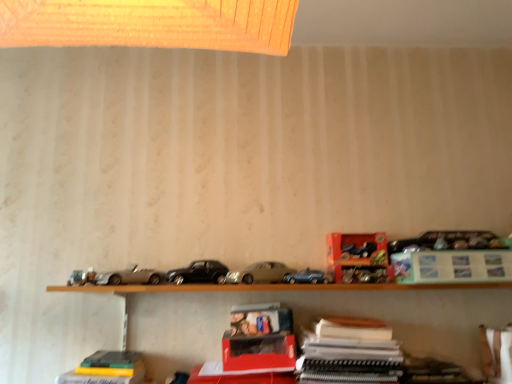
Question: Considering the relative sizes of metallic blue car at upper right, which is counted as the 1th toy, starting from the top, and matte silver car at center, acting as the first car starting from the right, in the image provided, is metallic blue car at upper right, which is counted as the 1th toy, starting from the top, wider than matte silver car at center, acting as the first car starting from the right,?

Choices:
 (A) yes
 (B) no

Answer: (B)

Question: Is metallic blue car at upper right, which is counted as the 1th toy, starting from the top, positioned with its back to matte silver car at center, acting as the first car starting from the right?

Choices:
 (A) no
 (B) yes

Answer: (A)

Question: Does metallic blue car at upper right, which is counted as the 1th toy, starting from the top, have a larger size compared to matte silver car at center, which is the second car from left to right?

Choices:
 (A) no
 (B) yes

Answer: (A)

Question: Can you confirm if metallic blue car at upper right, marked as the 2th toy in a bottom-to-top arrangement, is smaller than matte silver car at center, acting as the first car starting from the right?

Choices:
 (A) yes
 (B) no

Answer: (A)

Question: Does metallic blue car at upper right, which is counted as the 1th toy, starting from the top, appear on the left side of matte silver car at center, acting as the first car starting from the right?

Choices:
 (A) yes
 (B) no

Answer: (B)

Question: Considering the positions of point [x=339, y=319] and point [x=316, y=273], is point [x=339, y=319] closer or farther from the camera than point [x=316, y=273]?

Choices:
 (A) closer
 (B) farther

Answer: (A)

Question: From their relative heights in the image, would you say white paper at center, which is the second paperback book from right to left, is taller or shorter than metallic blue car at center, the 2th model car when ordered from left to right?

Choices:
 (A) tall
 (B) short

Answer: (A)

Question: Based on their positions, is white paper at center, which is the second paperback book from right to left, located to the left or right of metallic blue car at center, the first model car when ordered from right to left?

Choices:
 (A) right
 (B) left

Answer: (A)

Question: Is white paper at center, which is the 1th paperback book in left-to-right order, bigger or smaller than metallic blue car at center, the 2th model car when ordered from left to right?

Choices:
 (A) big
 (B) small

Answer: (A)

Question: Considering the positions of black metallic car at center, the second car positioned from the right, and wooden shelf at lower center in the image, is black metallic car at center, the second car positioned from the right, bigger or smaller than wooden shelf at lower center?

Choices:
 (A) big
 (B) small

Answer: (B)

Question: Based on their positions, is black metallic car at center, the second car positioned from the right, located to the left or right of wooden shelf at lower center?

Choices:
 (A) right
 (B) left

Answer: (B)

Question: From a real-world perspective, is black metallic car at center, the second car positioned from the right, physically located above or below wooden shelf at lower center?

Choices:
 (A) below
 (B) above

Answer: (B)

Question: In terms of width, does black metallic car at center, the second car positioned from the right, look wider or thinner when compared to wooden shelf at lower center?

Choices:
 (A) wide
 (B) thin

Answer: (A)

Question: From the image's perspective, relative to wooden shelf at lower center, is matte silver car at center, acting as the first car starting from the right, above or below?

Choices:
 (A) below
 (B) above

Answer: (B)

Question: Is matte silver car at center, acting as the first car starting from the right, taller or shorter than wooden shelf at lower center?

Choices:
 (A) short
 (B) tall

Answer: (A)